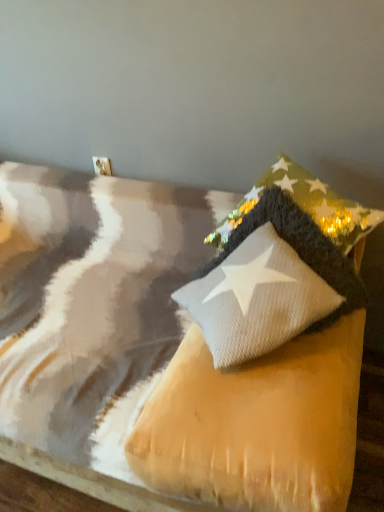
You are a GUI agent. You are given a task and a screenshot of the screen. Output one action in this format:
    pyautogui.click(x=<x>, y=<y>)
    Task: Click on the white textured pillow at center
    
    Given the screenshot: What is the action you would take?
    pyautogui.click(x=92, y=316)

What do you see at coordinates (92, 316) in the screenshot? This screenshot has height=512, width=384. I see `white textured pillow at center` at bounding box center [92, 316].

At what (x,y) coordinates should I click in order to perform the action: click on white textured pillow at center. Please return your answer as a coordinate pair (x, y). The width and height of the screenshot is (384, 512). Looking at the image, I should click on (92, 316).